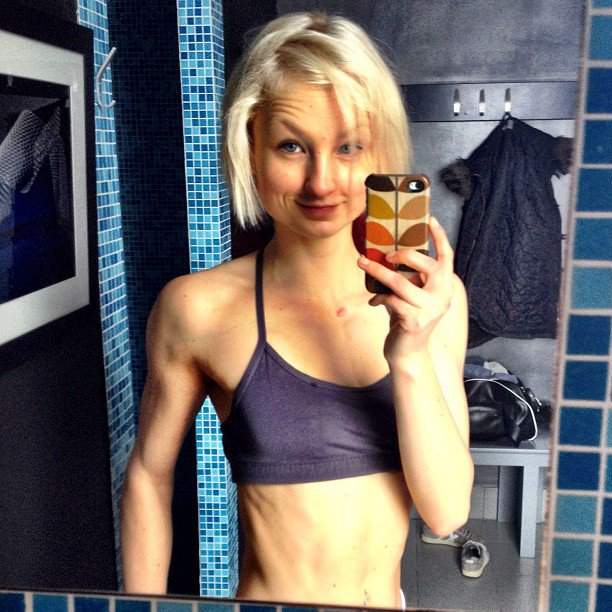
Find the location of a particular element. The height and width of the screenshot is (612, 612). mirror selfie is located at coordinates (x=404, y=158).